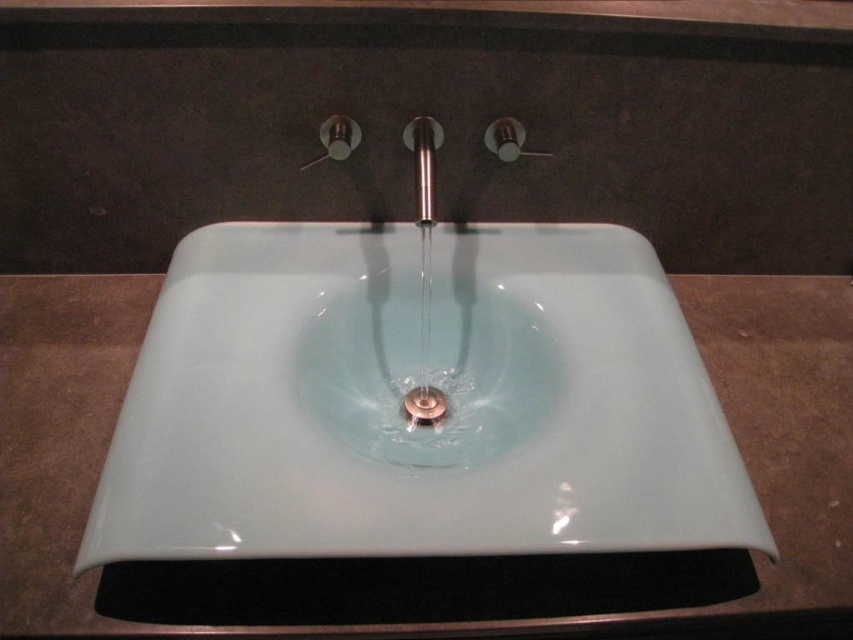
You are a plumber inspecting the bathroom sink. You notice two fixtures at the center of the sink area. Which one is closer to you, the polished stainless steel faucet at center or the satin nickel drain at center?

The polished stainless steel faucet at center is closer to you because it is in front of the satin nickel drain at center.

You are standing in front of the bathroom sink and need to locate two specific points marked on the wall. The first point is at coordinates point (164,476) and the second is at point (424,177). From your perspective, which point is closer to you?

Point (164,476) is in front of point (424,177), so the first point is closer to you.